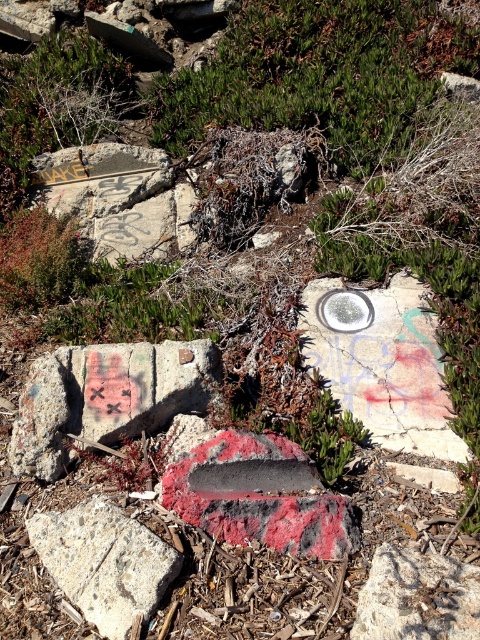
Question: Does painted concrete block at center appear under grungy concrete sign at upper left?

Choices:
 (A) no
 (B) yes

Answer: (B)

Question: Can you confirm if grungy concrete sign at upper left is wider than speckled concrete rock at lower left?

Choices:
 (A) yes
 (B) no

Answer: (A)

Question: Which of these objects is positioned farthest from the speckled concrete rock at lower left?

Choices:
 (A) painted concrete block at center
 (B) grungy concrete sign at upper left
 (C) smooth concrete circle at center

Answer: (B)

Question: Can you confirm if painted concrete block at center is bigger than speckled concrete rock at lower left?

Choices:
 (A) no
 (B) yes

Answer: (B)

Question: Which point is farther to the camera?

Choices:
 (A) grungy concrete sign at upper left
 (B) painted concrete block at center
 (C) smooth concrete circle at center
 (D) speckled concrete rock at lower left

Answer: (A)

Question: Which is nearer to the grungy concrete sign at upper left?

Choices:
 (A) painted concrete block at center
 (B) smooth red stone at center
 (C) smooth concrete circle at center

Answer: (C)